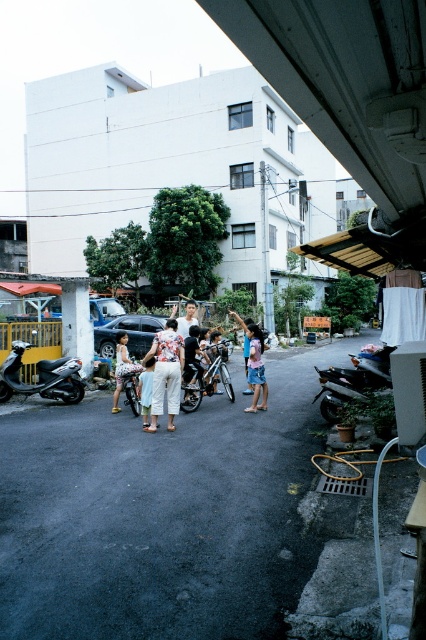
Question: Which of the following is the closest to the observer?

Choices:
 (A) metallic silver motorcycle at center
 (B) light blue denim shorts at center
 (C) white cotton dress at center

Answer: (A)

Question: Which object is closer to the camera taking this photo?

Choices:
 (A) matte white shirt at center
 (B) white cotton pants at center

Answer: (B)

Question: Estimate the real-world distances between objects in this image. Which object is closer to the white cotton dress at center?

Choices:
 (A) metallic silver motorcycle at center
 (B) shiny black motorcycle at lower right
 (C) light beige pants at center
 (D) white cotton pants at center

Answer: (C)

Question: Can you confirm if metallic silver motorcycle at center is wider than light beige pants at center?

Choices:
 (A) yes
 (B) no

Answer: (A)

Question: Is silver metallic scooter at left positioned before metallic silver motorcycle at center?

Choices:
 (A) yes
 (B) no

Answer: (B)

Question: Is shiny black motorcycle at lower right to the left of matte white shirt at center from the viewer's perspective?

Choices:
 (A) no
 (B) yes

Answer: (A)